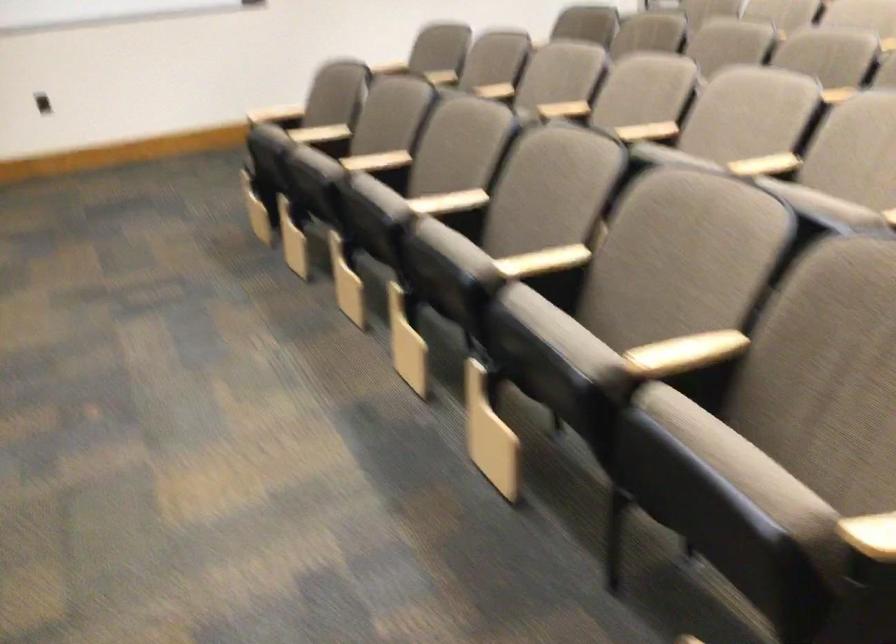
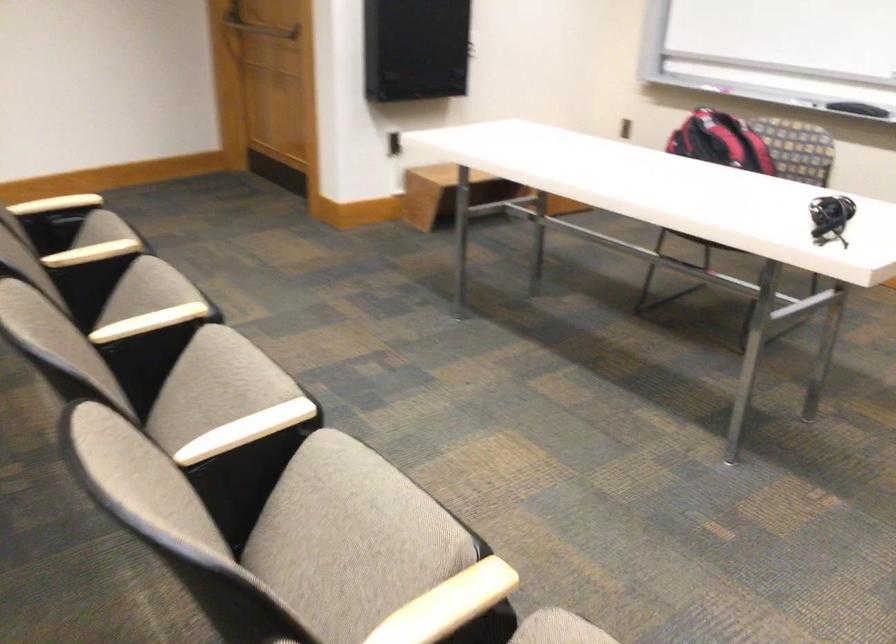
The point at (373, 196) is marked in the first image. Where is the corresponding point in the second image?

(352, 531)